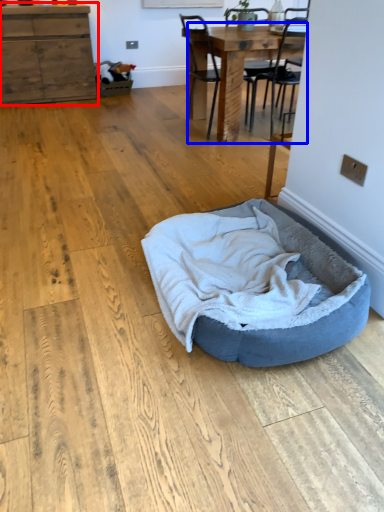
Question: Among these objects, which one is nearest to the camera, cabinetry (highlighted by a red box) or table (highlighted by a blue box)?

Choices:
 (A) cabinetry
 (B) table

Answer: (B)